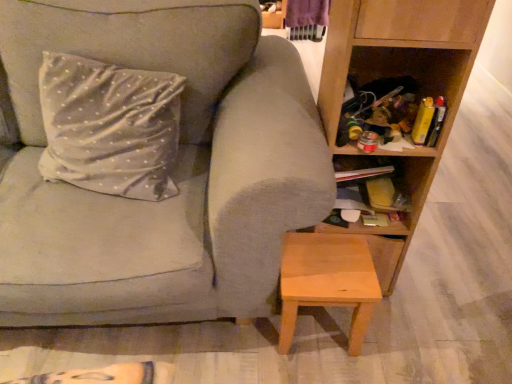
Question: Is wooden cabinet at lower right taller or shorter than silky silver pillow at upper left?

Choices:
 (A) tall
 (B) short

Answer: (B)

Question: From a real-world perspective, is wooden cabinet at lower right above or below silky silver pillow at upper left?

Choices:
 (A) below
 (B) above

Answer: (A)

Question: Based on their relative distances, which object is farther from the silky silver pillow at upper left?

Choices:
 (A) matte gray couch at center
 (B) wooden cabinet at lower right
 (C) light brown wooden stool at lower center
 (D) wooden shelf at right

Answer: (B)

Question: Estimate the real-world distances between objects in this image. Which object is closer to the wooden shelf at right?

Choices:
 (A) light brown wooden stool at lower center
 (B) silky silver pillow at upper left
 (C) matte gray couch at center
 (D) wooden cabinet at lower right

Answer: (D)